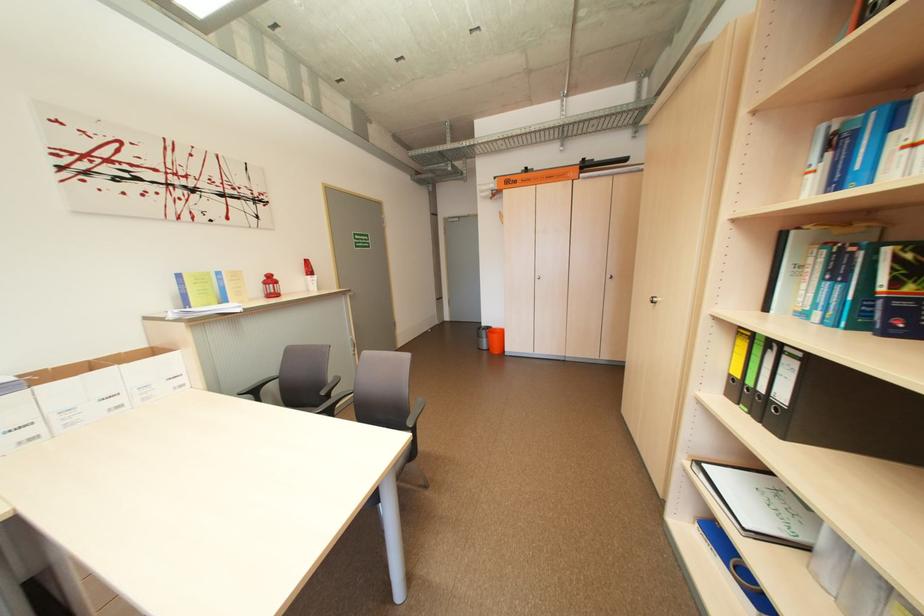
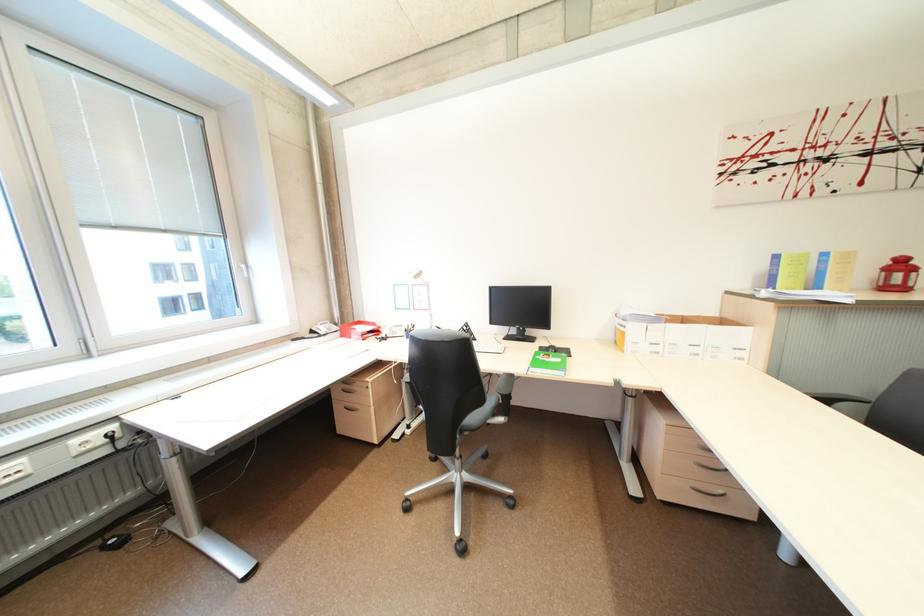
Locate, in the second image, the point that corresponds to point (188, 277) in the first image.

(785, 257)